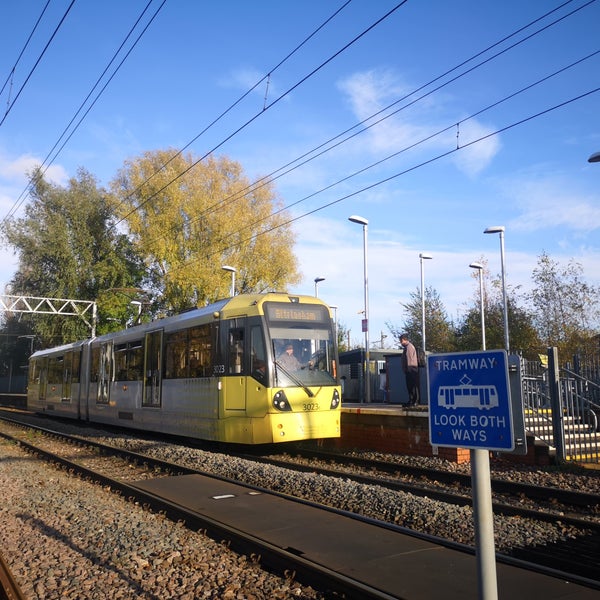
Find the location of a particular element. The height and width of the screenshot is (600, 600). metallic silver pole is located at coordinates (484, 491).